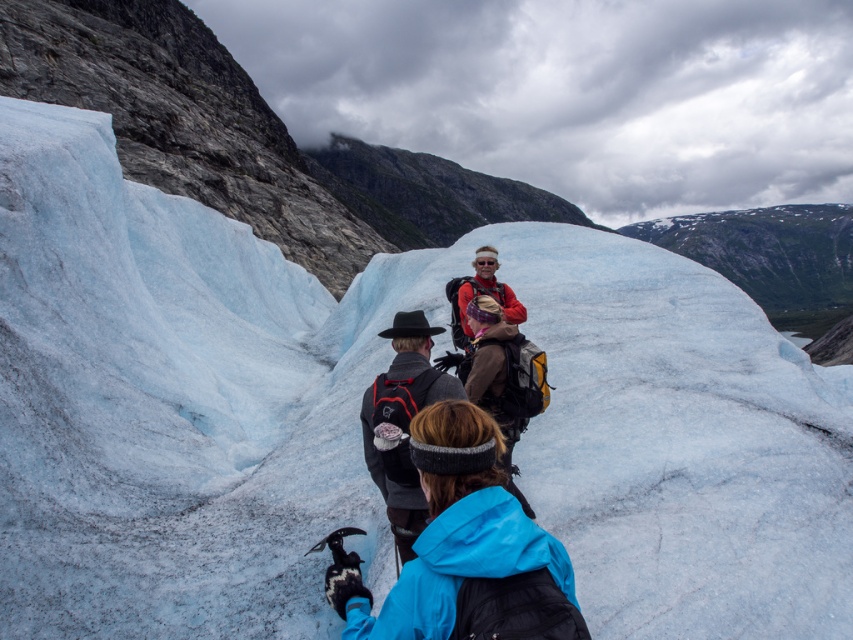
Who is higher up, blue synthetic jacket at center or matte red jacket at center?

matte red jacket at center is above.

Where is `blue synthetic jacket at center`? Image resolution: width=853 pixels, height=640 pixels. blue synthetic jacket at center is located at coordinates (451, 532).

Can you confirm if dark gray wool hat at center is positioned above matte red jacket at center?

Actually, dark gray wool hat at center is below matte red jacket at center.

Is point (415, 404) positioned in front of point (463, 333)?

Yes.

What do you see at coordinates (403, 420) in the screenshot? This screenshot has width=853, height=640. I see `dark gray wool hat at center` at bounding box center [403, 420].

Locate an element on the screen. dark gray wool hat at center is located at coordinates (403, 420).

Does point (473, 470) come farther from viewer compared to point (405, 416)?

No, it is in front of (405, 416).

Identify the location of blue synthetic jacket at center. The width and height of the screenshot is (853, 640). (451, 532).